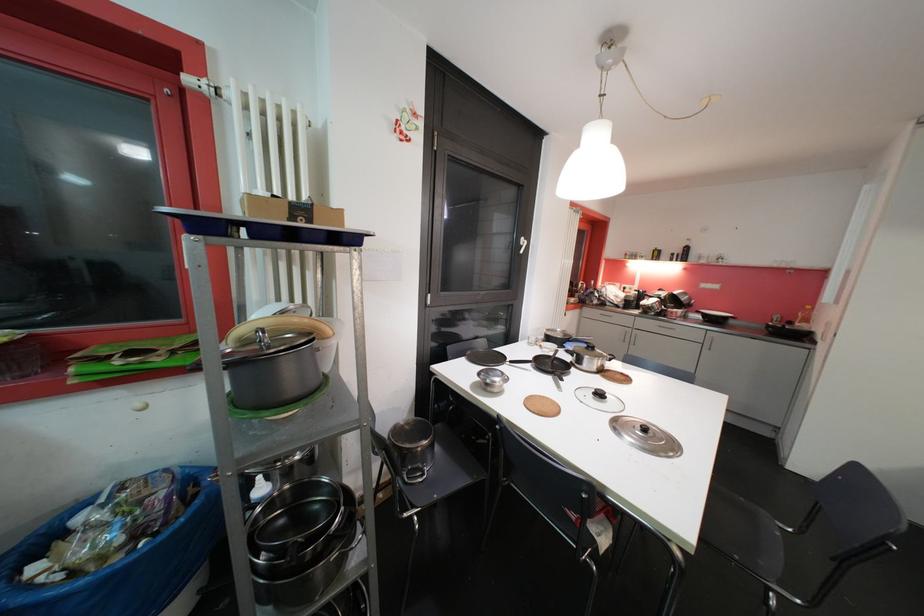
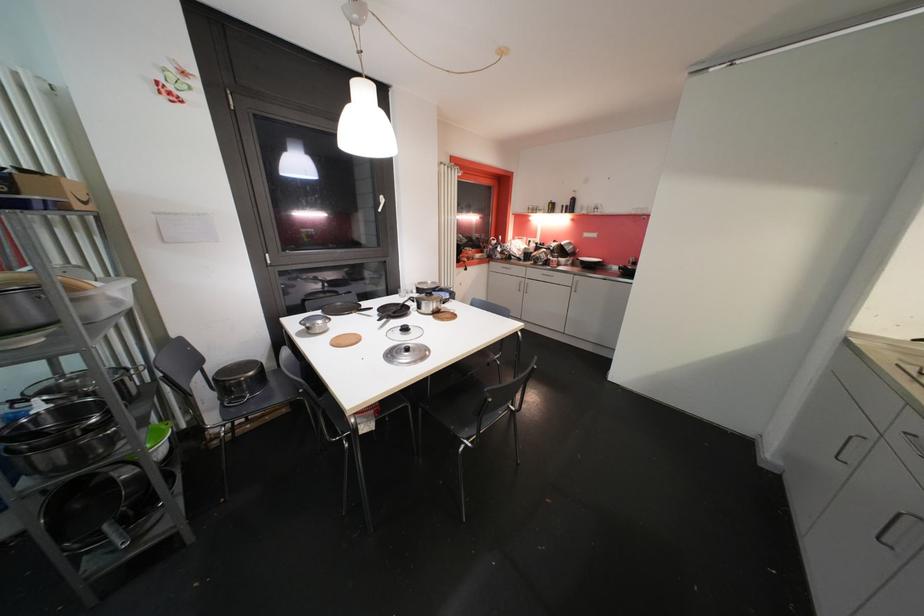
Locate, in the second image, the point that corresponds to point 604,397 in the first image.

(409, 331)